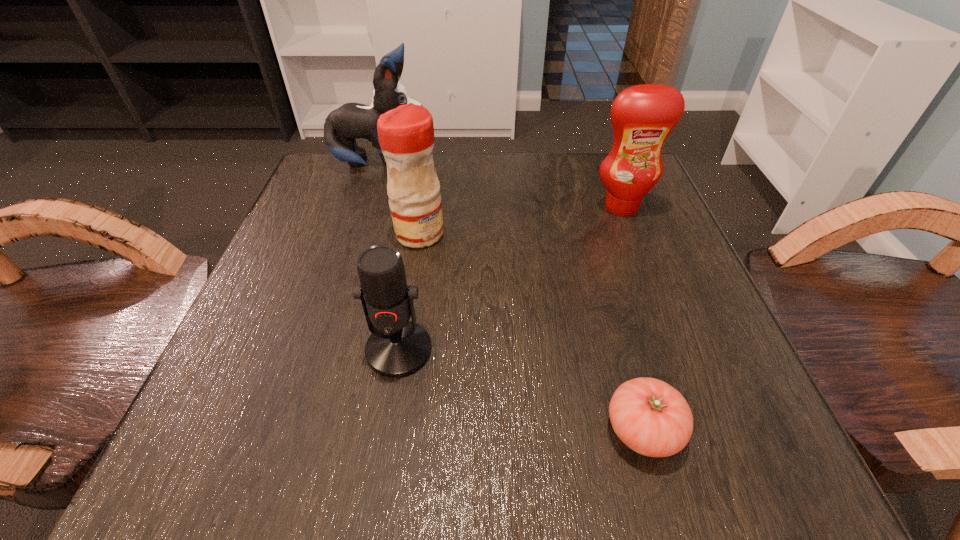
Locate an element on the screen. This screenshot has height=540, width=960. the farthest object is located at coordinates (351, 121).

At what (x,y) coordinates should I click in order to perform the action: click on the nearer condiment. Please return your answer as a coordinate pair (x, y). This screenshot has width=960, height=540. Looking at the image, I should click on (406, 134).

Image resolution: width=960 pixels, height=540 pixels. Find the location of `the left condiment`. the left condiment is located at coordinates (406, 134).

Find the location of a particular element. This screenshot has width=960, height=540. the right condiment is located at coordinates (643, 116).

Identify the location of the second farthest object. (643, 116).

Where is `microphone`? The width and height of the screenshot is (960, 540). microphone is located at coordinates (397, 347).

Where is `the second shortest object`? The width and height of the screenshot is (960, 540). the second shortest object is located at coordinates (397, 347).

I want to click on the shortest object, so click(652, 418).

The height and width of the screenshot is (540, 960). Find the location of `the nearest object`. the nearest object is located at coordinates (652, 418).

I want to click on free location located on the front-facing side of the puppy, so click(531, 164).